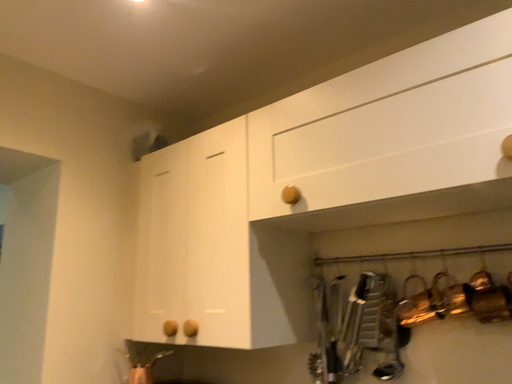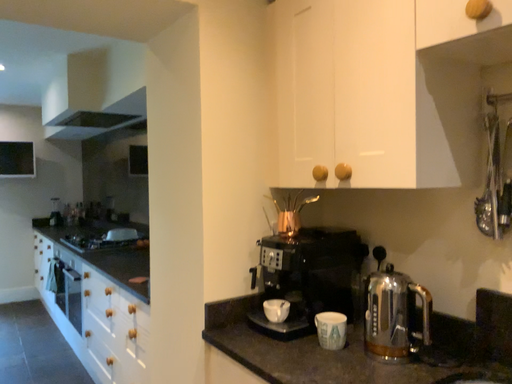
Question: How did the camera likely rotate when shooting the video?

Choices:
 (A) rotated downward
 (B) rotated upward

Answer: (A)